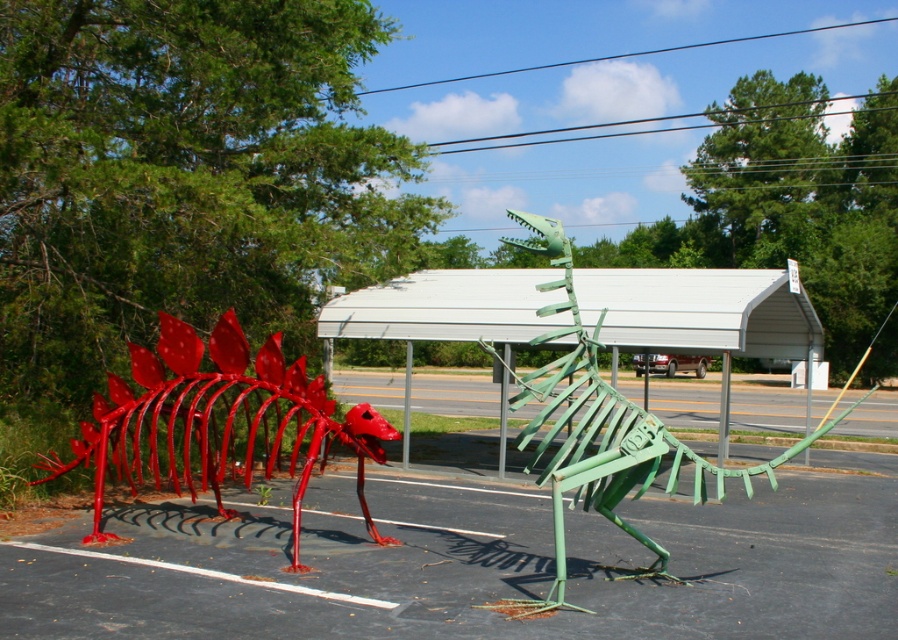
Based on the photo, you are a delivery driver who needs to park your truck between the metallic red dinosaur at left and the green metallic dinosaur at center. Given that your truck is 2.5 meters wide, can you safely park between them without touching either sculpture?

The metallic red dinosaur at left has a lesser width compared to the green metallic dinosaur at center. Since the truck is 2.5 meters wide, but the exact distance between the sculptures isn not provided, it is impossible to determine if there is enough space. However, the red sculpture being narrower might allow for a tighter fit, but safety cannot be guaranteed without knowing the actual spacing between them.

You are a visitor standing in front of the metallic red dinosaur at left and the green metallic dinosaur at center. Which dinosaur sculpture is closer to you?

The metallic red dinosaur at left is closer to you because it is positioned further to the viewer than the green metallic dinosaur at center, meaning it appears nearer in the image.